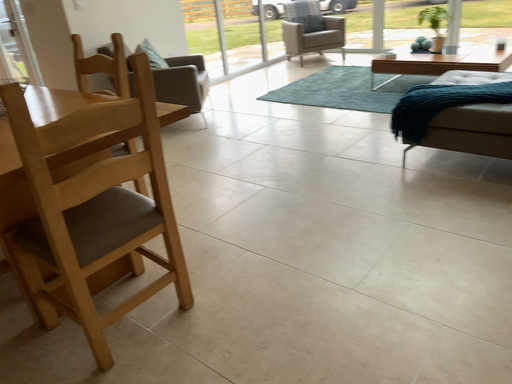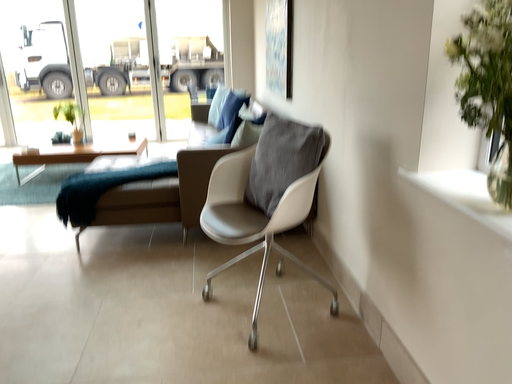
Question: How did the camera likely rotate when shooting the video?

Choices:
 (A) rotated right
 (B) rotated left

Answer: (A)